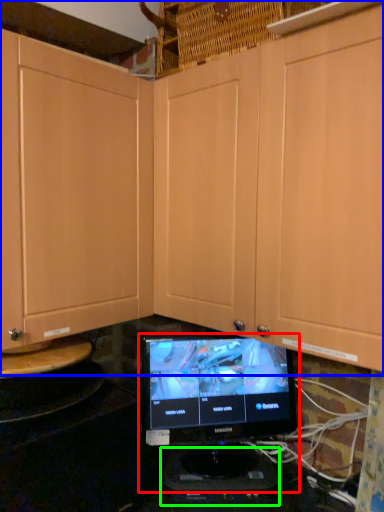
Question: Which object is the closest to the computer monitor (highlighted by a red box)? Choose among these: cabinetry (highlighted by a blue box) or appliance (highlighted by a green box).

Choices:
 (A) cabinetry
 (B) appliance

Answer: (B)